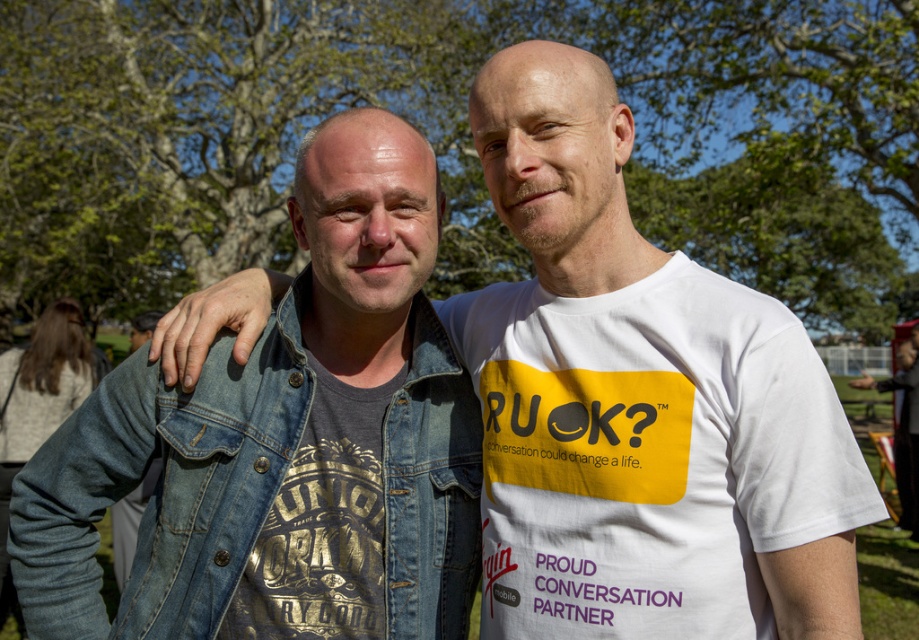
Question: Can you confirm if white cotton t-shirt at upper center is positioned below denim jacket at left?

Choices:
 (A) yes
 (B) no

Answer: (B)

Question: Which object is farther from the camera taking this photo?

Choices:
 (A) denim jacket at left
 (B) white cotton t-shirt at upper center

Answer: (A)

Question: Where is white cotton t-shirt at upper center located in relation to denim jacket at left in the image?

Choices:
 (A) left
 (B) right

Answer: (B)

Question: Which point appears farthest from the camera in this image?

Choices:
 (A) (666, 547)
 (B) (475, 436)

Answer: (B)

Question: Among these objects, which one is nearest to the camera?

Choices:
 (A) denim jacket at left
 (B) white cotton t-shirt at upper center

Answer: (B)

Question: Does white cotton t-shirt at upper center appear on the right side of denim jacket at left?

Choices:
 (A) yes
 (B) no

Answer: (A)